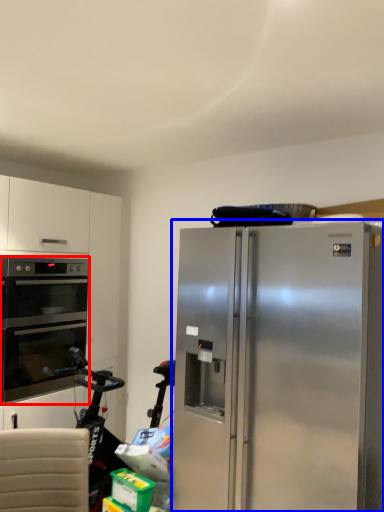
Question: Which point is closer to the camera, oven (highlighted by a red box) or refrigerator (highlighted by a blue box)?

Choices:
 (A) oven
 (B) refrigerator

Answer: (B)